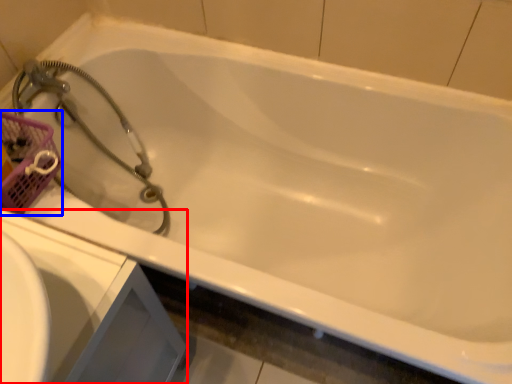
Question: Which object is further to the camera taking this photo, sink (highlighted by a red box) or basket (highlighted by a blue box)?

Choices:
 (A) sink
 (B) basket

Answer: (B)